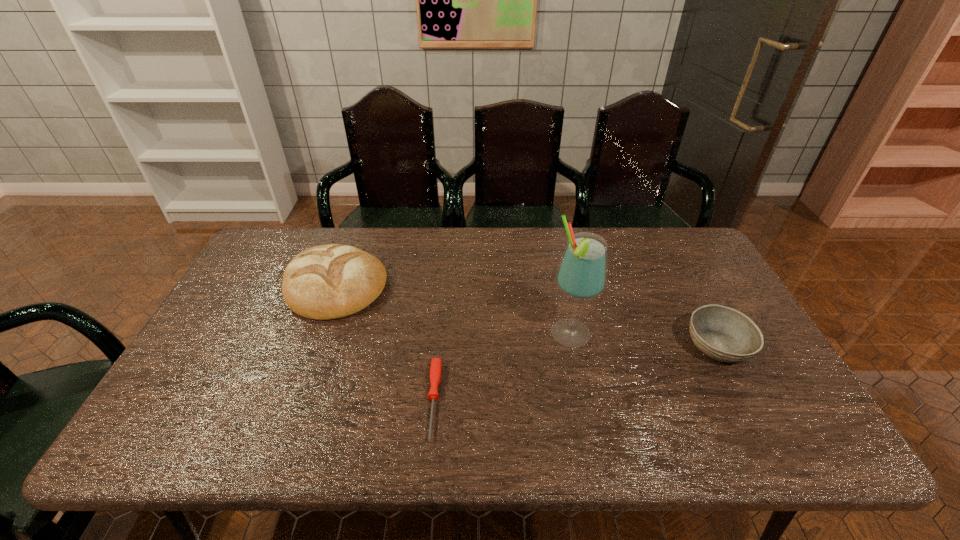
At what (x,y) coordinates should I click in order to perform the action: click on vacant space positioned 0.350m on the left of the second shortest object. Please return your answer as a coordinate pair (x, y). The width and height of the screenshot is (960, 540). Looking at the image, I should click on (555, 346).

Where is `object that is at the far edge`? This screenshot has width=960, height=540. object that is at the far edge is located at coordinates point(330,281).

This screenshot has width=960, height=540. Identify the location of object at the near edge. (435, 369).

Where is `object that is at the left edge`? This screenshot has height=540, width=960. object that is at the left edge is located at coordinates pos(330,281).

You are a GUI agent. You are given a task and a screenshot of the screen. Output one action in this format:
    pyautogui.click(x=<x>, y=<y>)
    Task: Click on the object situated at the right edge
    The height and width of the screenshot is (540, 960).
    Given the screenshot: What is the action you would take?
    pyautogui.click(x=724, y=334)

Locate an element on the screen. The width and height of the screenshot is (960, 540). object that is at the far left corner is located at coordinates (330, 281).

In order to click on free space at the far edge of the desktop in this screenshot , I will do `click(649, 255)`.

You are a GUI agent. You are given a task and a screenshot of the screen. Output one action in this format:
    pyautogui.click(x=<x>, y=<y>)
    Task: Click on the vacant region at the near edge
    This screenshot has width=960, height=540.
    Given the screenshot: What is the action you would take?
    pyautogui.click(x=590, y=444)

The image size is (960, 540). I want to click on free space at the left edge of the desktop, so click(207, 370).

In order to click on vacant region at the far right corner in this screenshot , I will do `click(665, 250)`.